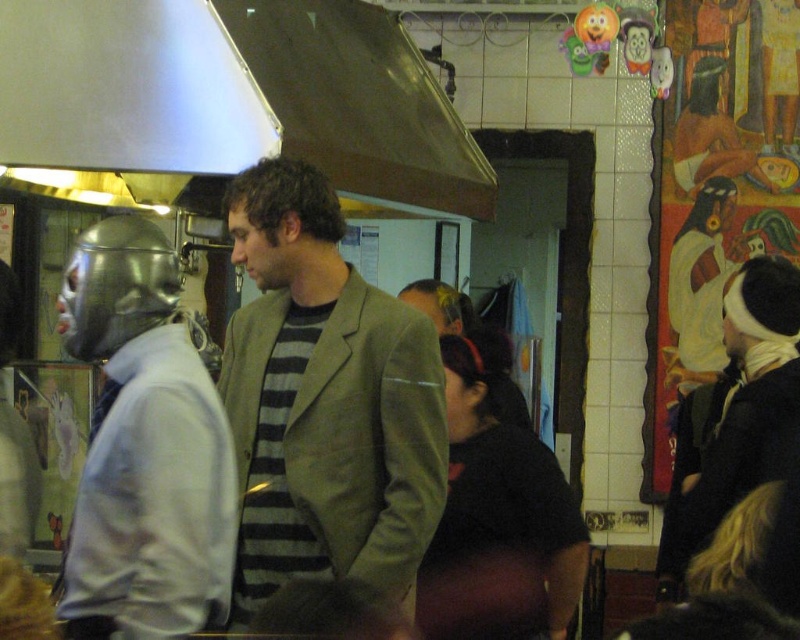
Who is more distant from viewer, (280,417) or (406,112)?

Positioned behind is point (406,112).

At what (x,y) coordinates should I click in order to perform the action: click on gray wool blazer at center. Please return your answer as a coordinate pair (x, y). The image size is (800, 640). Looking at the image, I should click on [325, 401].

Is gray wool blazer at center to the right of metallic silver helmet at left from the viewer's perspective?

Yes, gray wool blazer at center is to the right of metallic silver helmet at left.

Consider the image. Can you confirm if gray wool blazer at center is bigger than metallic silver helmet at left?

Yes.

Image resolution: width=800 pixels, height=640 pixels. I want to click on gray wool blazer at center, so click(325, 401).

Which is more to the right, metallic silver helmet at left or metallic silver exhaust hood at upper left?

metallic silver helmet at left is more to the right.

Does metallic silver helmet at left appear on the right side of metallic silver exhaust hood at upper left?

Yes, metallic silver helmet at left is to the right of metallic silver exhaust hood at upper left.

Describe the element at coordinates (145, 445) in the screenshot. The width and height of the screenshot is (800, 640). I see `metallic silver helmet at left` at that location.

Locate an element on the screen. Image resolution: width=800 pixels, height=640 pixels. metallic silver helmet at left is located at coordinates (145, 445).